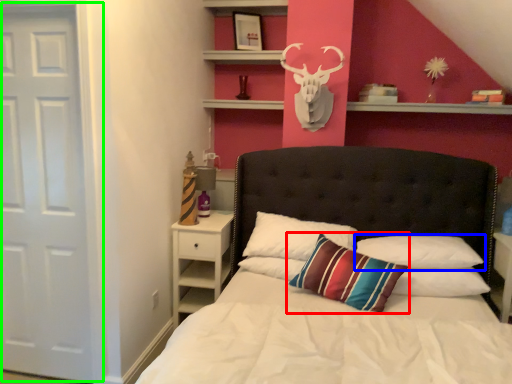
Question: Based on their relative distances, which object is farther from pillow (highlighted by a red box)? Choose from pillow (highlighted by a blue box) and door (highlighted by a green box).

Choices:
 (A) pillow
 (B) door

Answer: (B)